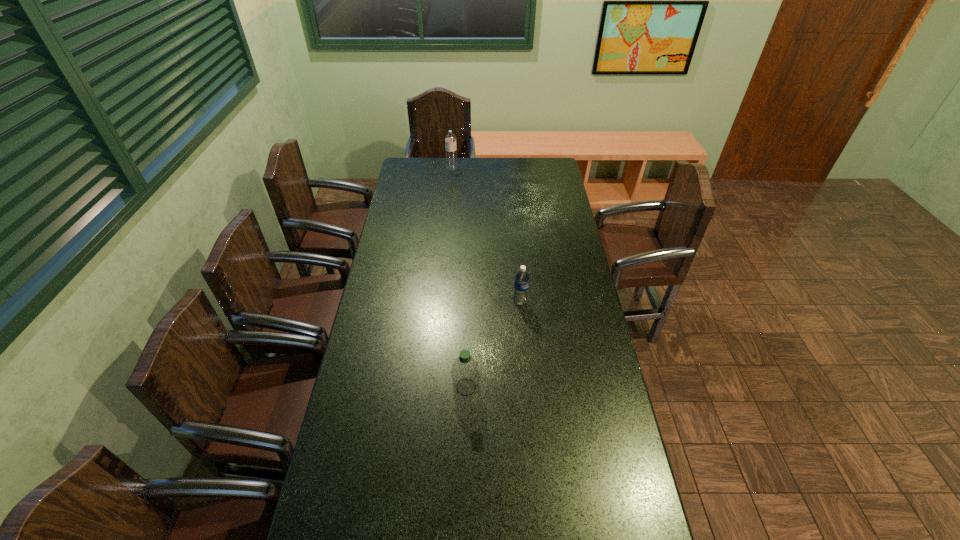
Locate an element on the screen. This screenshot has height=540, width=960. object that is the second closest to the nearest water bottle is located at coordinates (450, 139).

Identify which water bottle is located as the nearest to the rightmost object. Please provide its 2D coordinates. Your answer should be formatted as a tuple, i.e. [(x, y)], where the tuple contains the x and y coordinates of a point satisfying the conditions above.

[(465, 371)]

Identify which water bottle is located as the second nearest to the second water bottle from right to left. Please provide its 2D coordinates. Your answer should be formatted as a tuple, i.e. [(x, y)], where the tuple contains the x and y coordinates of a point satisfying the conditions above.

[(450, 139)]